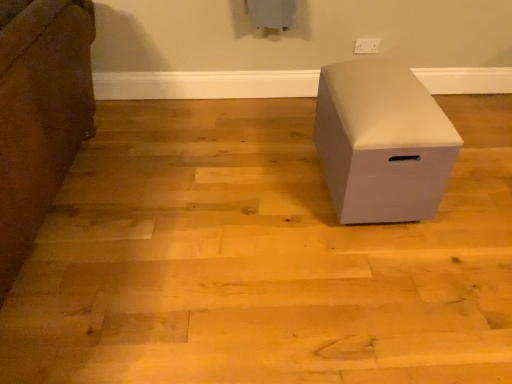
Question: Is white plastic electric outlet at upper center inside or outside of white matte storage box at center, which is the second furniture in right-to-left order?

Choices:
 (A) inside
 (B) outside

Answer: (B)

Question: Based on their positions, is white plastic electric outlet at upper center located to the left or right of white matte storage box at center, which is the second furniture in right-to-left order?

Choices:
 (A) right
 (B) left

Answer: (A)

Question: Which is farther from the white matte storage box at center, which is the second furniture in right-to-left order?

Choices:
 (A) white plastic electric outlet at upper center
 (B) white matte storage box at center, the 2th furniture in the left-to-right sequence

Answer: (A)

Question: Estimate the real-world distances between objects in this image. Which object is closer to the white matte storage box at center, which is the 1th furniture from left to right?

Choices:
 (A) white plastic electric outlet at upper center
 (B) white matte storage box at center, the 2th furniture in the left-to-right sequence

Answer: (B)